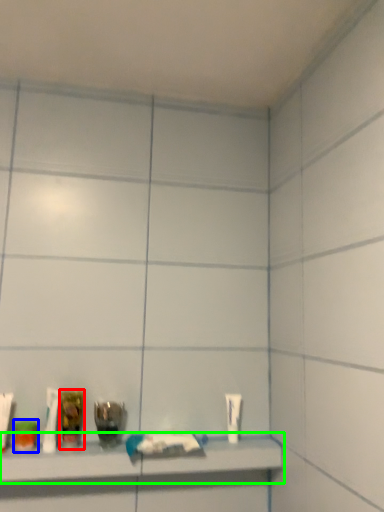
Question: Considering the real-world distances, which object is closest to mouthwash (highlighted by a red box)? mouthwash (highlighted by a blue box) or shelf (highlighted by a green box).

Choices:
 (A) mouthwash
 (B) shelf

Answer: (A)